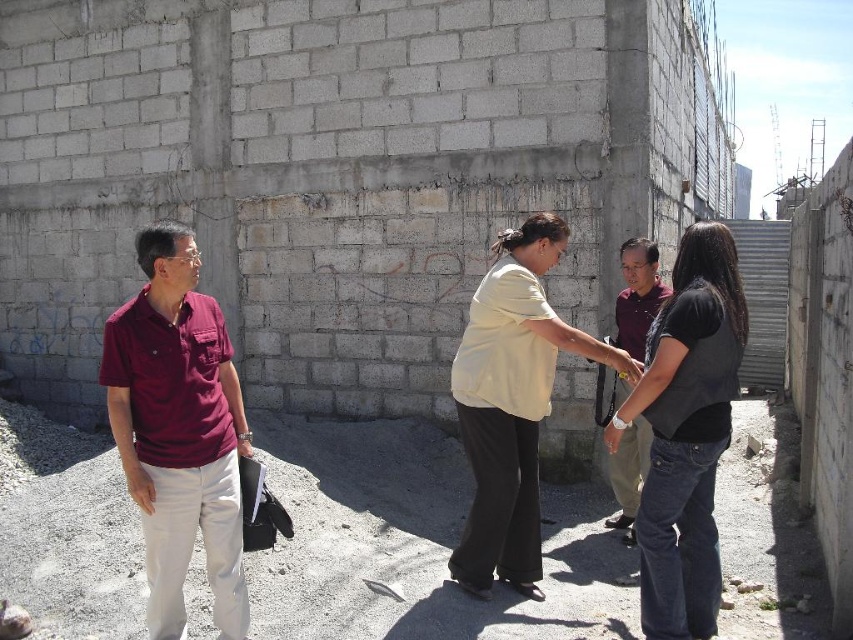
Does black denim jeans at lower right come in front of maroon shirt at center?

Yes, black denim jeans at lower right is in front of maroon shirt at center.

Between black denim jeans at lower right and maroon shirt at center, which one has more height?

Standing taller between the two is black denim jeans at lower right.

At what (x,y) coordinates should I click in order to perform the action: click on black denim jeans at lower right. Please return your answer as a coordinate pair (x, y). This screenshot has width=853, height=640. Looking at the image, I should click on (686, 433).

Who is positioned more to the left, maroon fabric shirt at left or black denim jeans at lower right?

From the viewer's perspective, maroon fabric shirt at left appears more on the left side.

Does maroon fabric shirt at left appear on the right side of black denim jeans at lower right?

In fact, maroon fabric shirt at left is to the left of black denim jeans at lower right.

I want to click on maroon fabric shirt at left, so tap(178, 429).

Which is above, black denim jeans at lower right or light yellow cotton shirt at center?

light yellow cotton shirt at center is higher up.

Can you confirm if black denim jeans at lower right is wider than light yellow cotton shirt at center?

In fact, black denim jeans at lower right might be narrower than light yellow cotton shirt at center.

Is point (631, 420) less distant than point (531, 566)?

Yes, it is in front of point (531, 566).

Find the location of a particular element. black denim jeans at lower right is located at coordinates click(x=686, y=433).